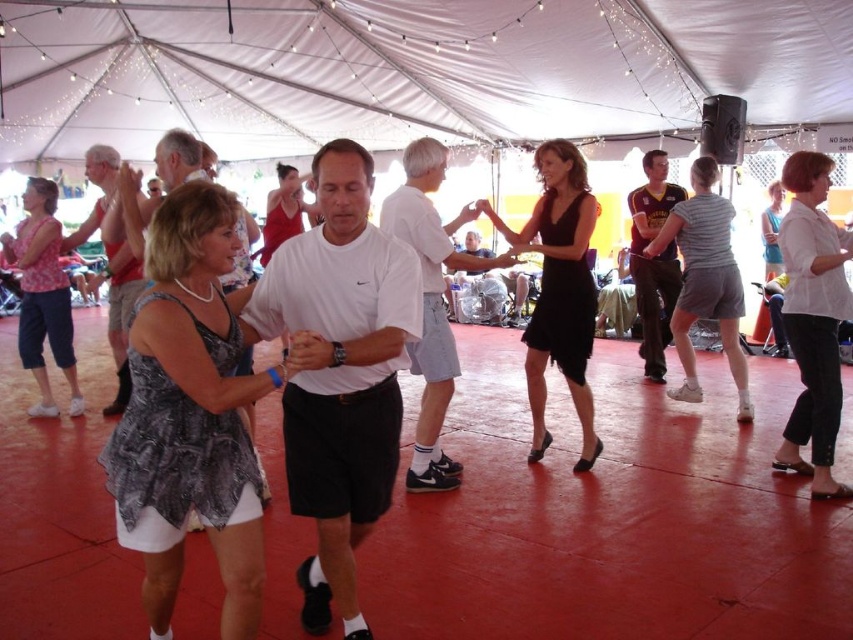
You are planning to hang a new decoration that requires at least 2 meters of space. You see the white fabric canopy at upper center and the matte black dress at center. Which object provides enough space for your decoration?

The white fabric canopy at upper center has a larger size compared to the matte black dress at center, so it provides enough space for the decoration requiring at least 2 meters.